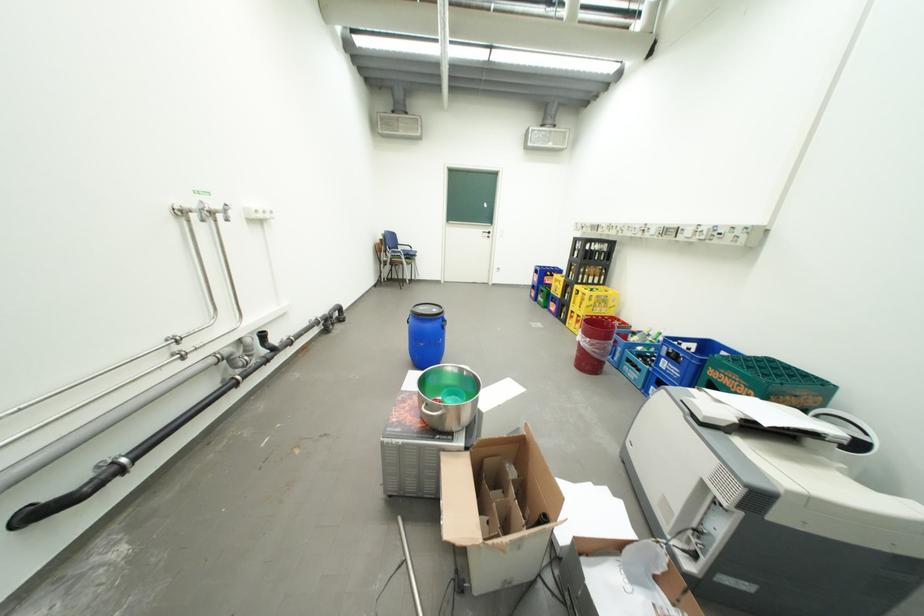
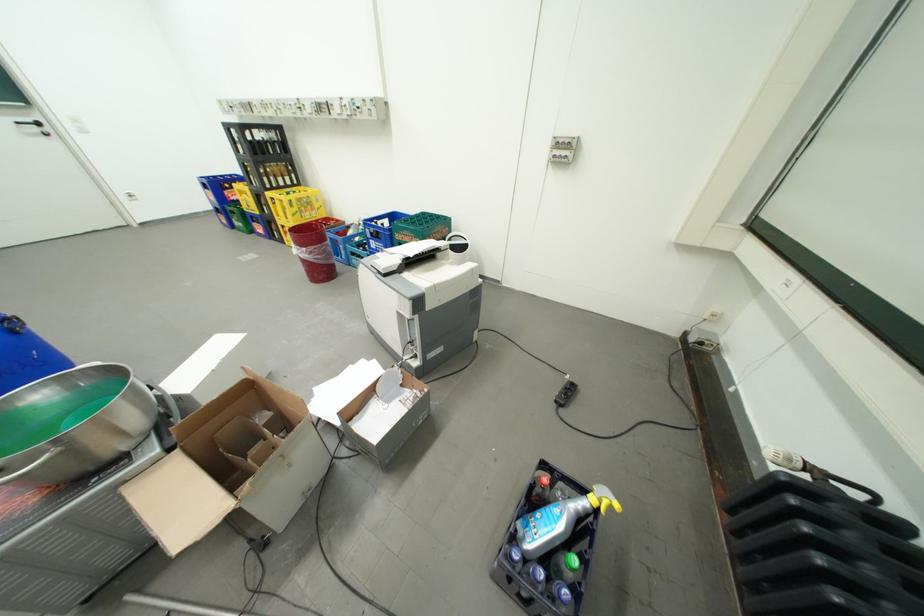
Where in the second image is the point corresponding to point (602, 309) from the first image?

(310, 215)